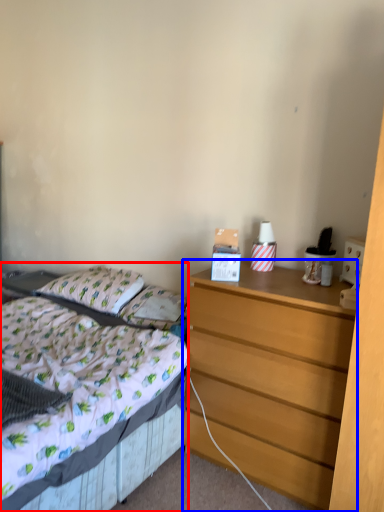
Question: Among these objects, which one is farthest to the camera, bed (highlighted by a red box) or chest of drawers (highlighted by a blue box)?

Choices:
 (A) bed
 (B) chest of drawers

Answer: (B)